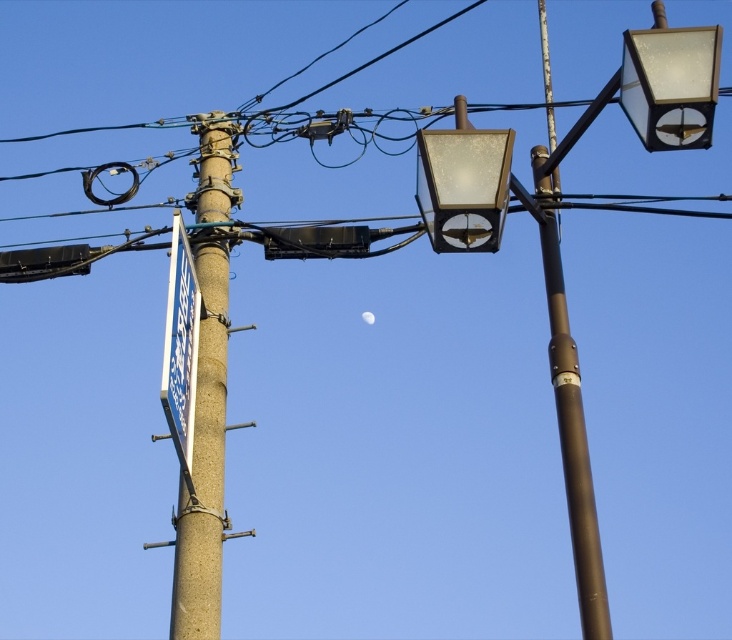
Question: Observing the image, what is the correct spatial positioning of translucent glass streetlight at upper right in reference to matte glass streetlight at upper center?

Choices:
 (A) right
 (B) left

Answer: (A)

Question: Among these points, which one is nearest to the camera?

Choices:
 (A) (575, 380)
 (B) (553, 323)

Answer: (A)

Question: Which object appears closest to the camera in this image?

Choices:
 (A) brown metallic pole at upper right
 (B) matte brown street light at upper right
 (C) blue plastic sign at left
 (D) matte glass streetlight at upper center

Answer: (B)

Question: Is matte glass streetlight at upper center smaller than white matte moon at center?

Choices:
 (A) yes
 (B) no

Answer: (B)

Question: Is concrete textured telegraph pole at left wider than blue plastic sign at left?

Choices:
 (A) no
 (B) yes

Answer: (A)

Question: Which point appears farthest from the camera in this image?

Choices:
 (A) (362, 314)
 (B) (553, 321)
 (C) (496, 150)

Answer: (A)